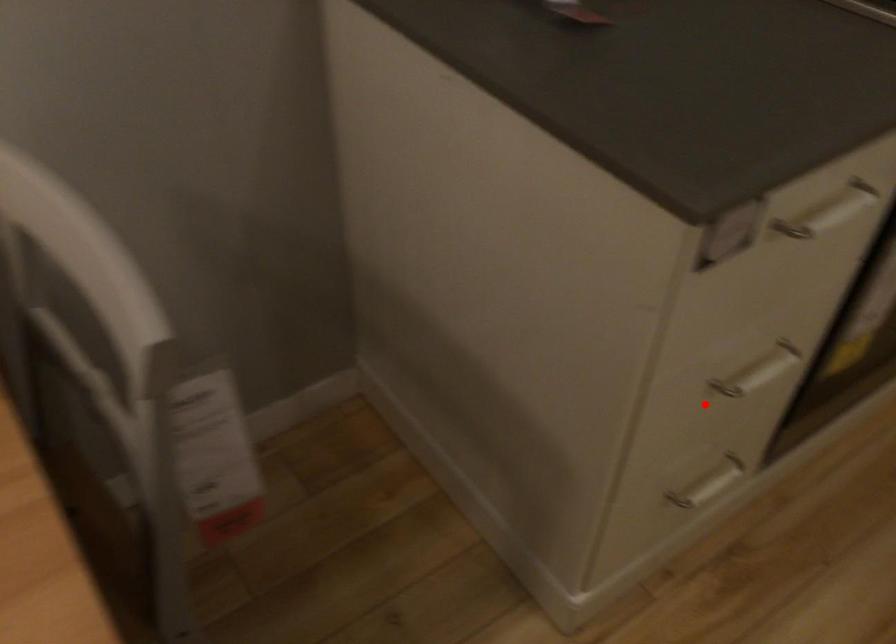
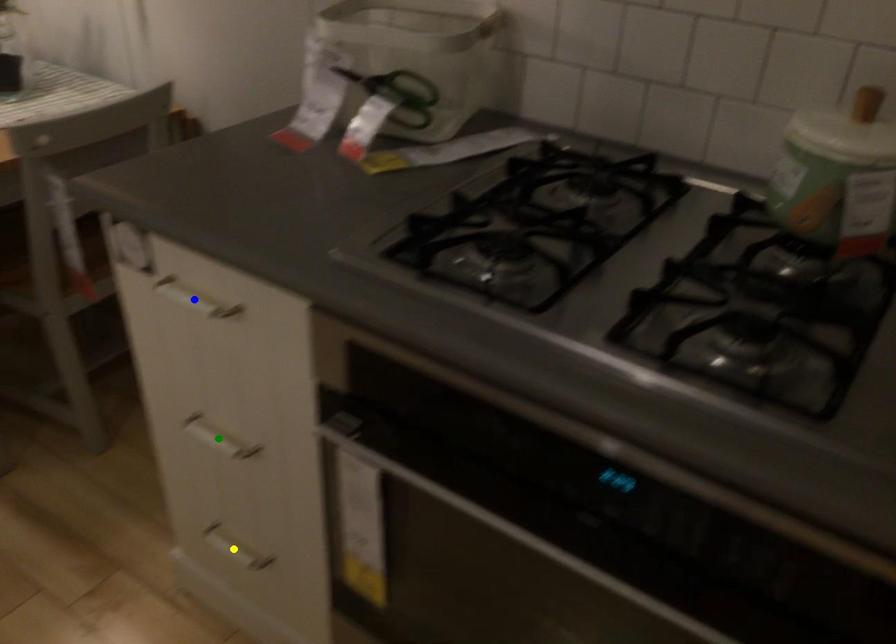
Question: I am providing you with two images of the same scene from different viewpoints. A red point is marked on the first image. You are given multiple points on the second image. Which point in image 2 is actually the same real-world point as the red point in image 1?

Choices:
 (A) green point
 (B) yellow point
 (C) blue point

Answer: (A)